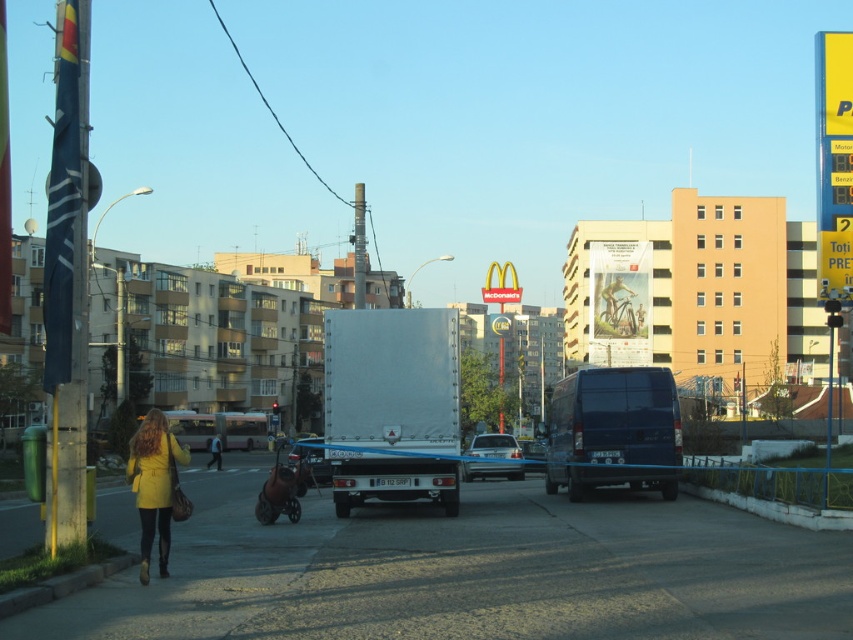
Question: Among these objects, which one is farthest from the camera?

Choices:
 (A) yellow matte jacket at lower left
 (B) blue metallic car at center
 (C) metallic silver car at center

Answer: (A)

Question: Among these objects, which one is farthest from the camera?

Choices:
 (A) brown leather baby carriage at center
 (B) dark blue van at center

Answer: (B)

Question: Which is nearer to the yellow matte coat at lower left?

Choices:
 (A) yellow matte jacket at lower left
 (B) brown leather baby carriage at center

Answer: (B)

Question: Does yellow matte coat at lower left have a larger size compared to brown leather baby carriage at center?

Choices:
 (A) no
 (B) yes

Answer: (A)

Question: Is yellow matte coat at lower left to the right of yellow matte jacket at lower left from the viewer's perspective?

Choices:
 (A) no
 (B) yes

Answer: (B)

Question: Does blue metallic car at center appear over metallic silver car at center?

Choices:
 (A) no
 (B) yes

Answer: (B)